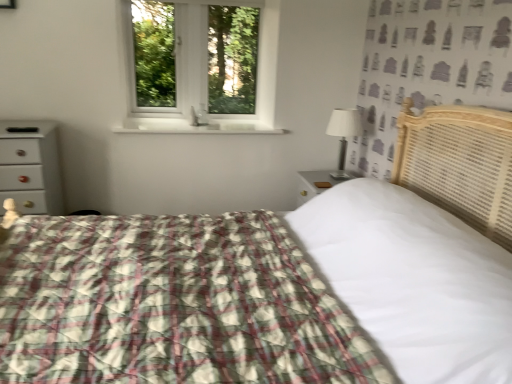
Describe the element at coordinates (30, 166) in the screenshot. I see `white glossy chest of drawers at left` at that location.

What is the approximate width of white glossy chest of drawers at left?

white glossy chest of drawers at left is 16.61 inches in width.

Locate an element on the screen. white glossy window sill at center is located at coordinates (195, 126).

Describe the element at coordinates (201, 77) in the screenshot. I see `white plastic window at upper center` at that location.

Describe the element at coordinates (343, 135) in the screenshot. I see `white fabric-covered lamp at right` at that location.

Locate an element on the screen. The width and height of the screenshot is (512, 384). white glossy chest of drawers at left is located at coordinates (30, 166).

Is plaid fabric bed at center oriented towards white fabric-covered lamp at right?

No, plaid fabric bed at center does not turn towards white fabric-covered lamp at right.

From the image's perspective, relative to white fabric-covered lamp at right, is plaid fabric bed at center above or below?

plaid fabric bed at center is situated lower than white fabric-covered lamp at right in the image.

Does point (0, 180) come farther from viewer compared to point (187, 76)?

No.

How different are the orientations of white glossy chest of drawers at left and white plastic window at upper center in degrees?

The angle between the facing direction of white glossy chest of drawers at left and the facing direction of white plastic window at upper center is 1.25 degrees.

Can we say white glossy chest of drawers at left lies outside white plastic window at upper center?

Yes.

From the picture: Between white glossy chest of drawers at left and white plastic window at upper center, which one has less height?

Standing shorter between the two is white glossy chest of drawers at left.

Considering the relative sizes of white glossy window sill at center and plaid fabric bed at center in the image provided, is white glossy window sill at center taller than plaid fabric bed at center?

No, white glossy window sill at center is not taller than plaid fabric bed at center.

From the picture: Is white glossy window sill at center positioned beyond the bounds of plaid fabric bed at center?

white glossy window sill at center lies outside plaid fabric bed at center's area.

Would you say white glossy window sill at center is a long distance from plaid fabric bed at center?

That's right, there is a large distance between white glossy window sill at center and plaid fabric bed at center.

Is white glossy window sill at center oriented away from plaid fabric bed at center?

No, white glossy window sill at center is not facing away from plaid fabric bed at center.

Is white plastic window at upper center wider or thinner than white glossy chest of drawers at left?

white plastic window at upper center is thinner than white glossy chest of drawers at left.

Considering the points (272, 93) and (59, 184), which point is in front, point (272, 93) or point (59, 184)?

Positioned in front is point (59, 184).

From a real-world perspective, who is located lower, white plastic window at upper center or white glossy chest of drawers at left?

white glossy chest of drawers at left.

Is white plastic window at upper center not close to white glossy chest of drawers at left?

No, white plastic window at upper center is not far from white glossy chest of drawers at left.

From the image's perspective, which is above, white plastic window at upper center or white glossy window sill at center?

From the image's view, white plastic window at upper center is above.

Where is `window above the white glossy window sill at center (from a real-world perspective)`? window above the white glossy window sill at center (from a real-world perspective) is located at coordinates (201, 77).

Does white plastic window at upper center appear on the left side of white glossy window sill at center?

Yes, white plastic window at upper center is to the left of white glossy window sill at center.

Is point (225, 116) closer or farther from the camera than point (205, 128)?

Point (225, 116) is positioned farther from the camera compared to point (205, 128).

Does white glossy window sill at center come behind white glossy chest of drawers at left?

Yes, it is behind white glossy chest of drawers at left.

Is white glossy window sill at center with white glossy chest of drawers at left?

No, white glossy window sill at center is not beside white glossy chest of drawers at left.

Is white glossy window sill at center to the left or to the right of white glossy chest of drawers at left in the image?

In the image, white glossy window sill at center appears on the right side of white glossy chest of drawers at left.

Choose the correct answer: Is white glossy window sill at center inside white glossy chest of drawers at left or outside it?

white glossy window sill at center is not inside white glossy chest of drawers at left, it's outside.

Between point (225, 300) and point (137, 131), which one is positioned behind?

The point (137, 131) is more distant.

Based on the photo, can you confirm if plaid fabric bed at center is wider than white glossy window sill at center?

Indeed, plaid fabric bed at center has a greater width compared to white glossy window sill at center.

Considering the positions of objects plaid fabric bed at center and white glossy window sill at center in the image provided, who is behind, plaid fabric bed at center or white glossy window sill at center?

Positioned behind is white glossy window sill at center.

What's the angular difference between plaid fabric bed at center and white glossy window sill at center's facing directions?

They differ by 89.7 degrees in their facing directions.

The width and height of the screenshot is (512, 384). Identify the location of table lamp on the right of the plaid fabric bed at center. (343, 135).

Identify the location of the chest of drawers lying below the white plastic window at upper center (from the image's perspective). The width and height of the screenshot is (512, 384). coord(30,166).

Considering their positions, is white plastic window at upper center positioned closer to white glossy chest of drawers at left than white glossy window sill at center?

white glossy window sill at center lies closer to white glossy chest of drawers at left than the other object.

From the image, which object appears to be farther from plaid fabric bed at center, white plastic window at upper center or white glossy window sill at center?

The object further to plaid fabric bed at center is white glossy window sill at center.

Looking at the image, which one is located closer to white glossy chest of drawers at left, plaid fabric bed at center or white plastic window at upper center?

white plastic window at upper center lies closer to white glossy chest of drawers at left than the other object.

From the image, which object appears to be farther from white glossy window sill at center, plaid fabric bed at center or white fabric-covered lamp at right?

Based on the image, plaid fabric bed at center appears to be further to white glossy window sill at center.

Consider the image. From the image, which object appears to be nearer to white fabric-covered lamp at right, white plastic window at upper center or plaid fabric bed at center?

white plastic window at upper center.

Looking at the image, which one is located closer to plaid fabric bed at center, white fabric-covered lamp at right or white plastic window at upper center?

white fabric-covered lamp at right is positioned closer to the anchor plaid fabric bed at center.

Considering their positions, is plaid fabric bed at center positioned closer to white fabric-covered lamp at right than white glossy chest of drawers at left?

Based on the image, plaid fabric bed at center appears to be nearer to white fabric-covered lamp at right.

Which object lies further to the anchor point white fabric-covered lamp at right, white glossy window sill at center or white plastic window at upper center?

The object further to white fabric-covered lamp at right is white plastic window at upper center.

You are a GUI agent. You are given a task and a screenshot of the screen. Output one action in this format:
    pyautogui.click(x=<x>, y=<y>)
    Task: Click on the window sill positioned between plaid fabric bed at center and white plastic window at upper center from near to far
    The height and width of the screenshot is (384, 512).
    Given the screenshot: What is the action you would take?
    pyautogui.click(x=195, y=126)

This screenshot has height=384, width=512. What are the coordinates of `window between white glossy chest of drawers at left and white glossy window sill at center in the horizontal direction` in the screenshot? It's located at (201, 77).

Where is `window sill between white glossy chest of drawers at left and white fabric-covered lamp at right from left to right`? window sill between white glossy chest of drawers at left and white fabric-covered lamp at right from left to right is located at coordinates (195, 126).

Locate an element on the screen. The height and width of the screenshot is (384, 512). the chest of drawers positioned between plaid fabric bed at center and white fabric-covered lamp at right from near to far is located at coordinates (30, 166).